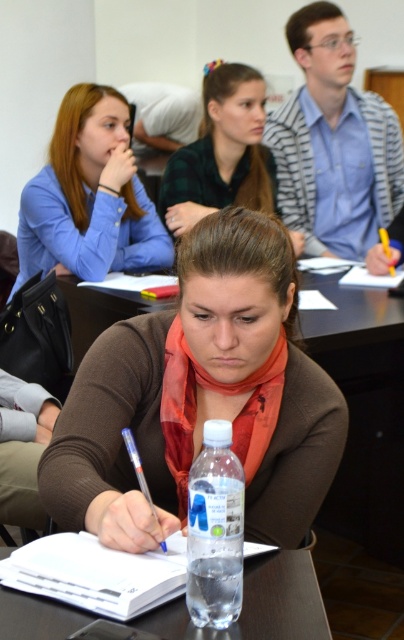
You are standing in front of the table where the woman is writing. There are two points marked on the table. One is at coordinates point (35, 240) and the other is at point (222, 147). Which point is closer to you?

Point (35, 240) is closer to the viewer than point (222, 147).

You are sitting at the table and want to hand a note to the person wearing the green plaid shirt at upper center. Which direction should you move to reach them from the brown matte scarf at center?

The brown matte scarf at center is to the left of the green plaid shirt at upper center, so you should move to the right to reach the green plaid shirt at upper center from the brown matte scarf at center.

You are standing in front of the classroom table and want to place a 40 inch long object from left to right. Is there enough space between the left edge of the table and point [202,262] to fit it?

The distance from the viewer to point [202,262] is 38.33 inches. Since the object is 40 inches long, it won